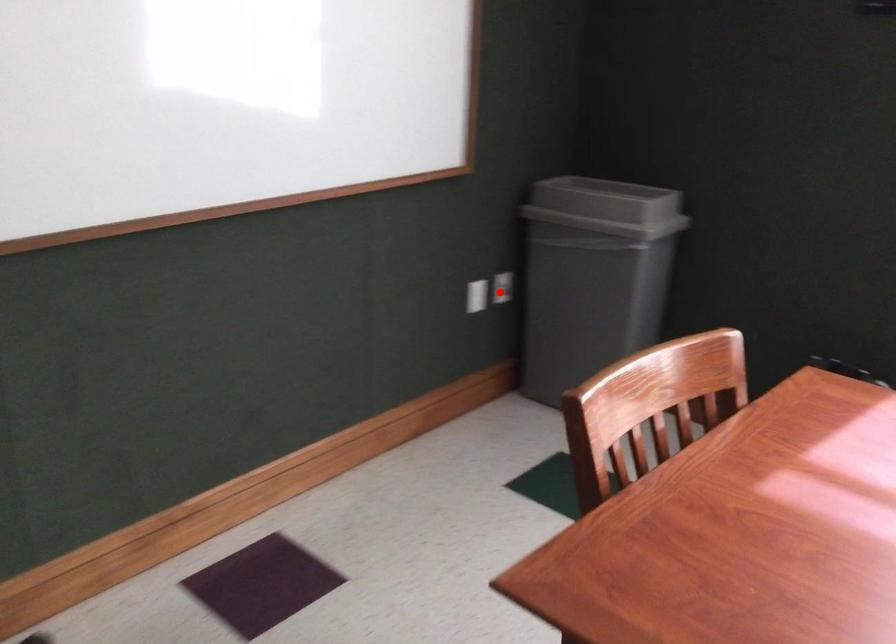
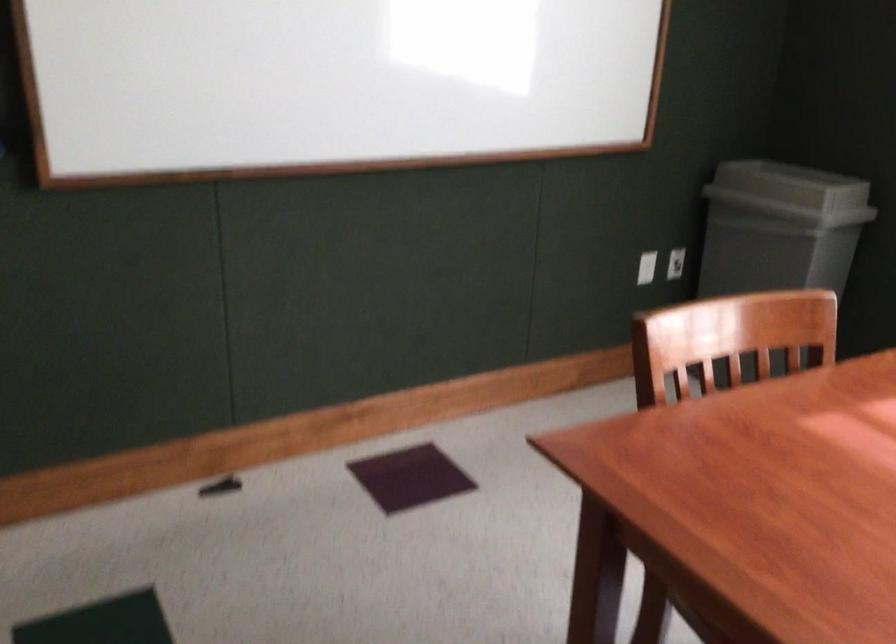
The point at the highlighted location is marked in the first image. Where is the corresponding point in the second image?

(675, 263)